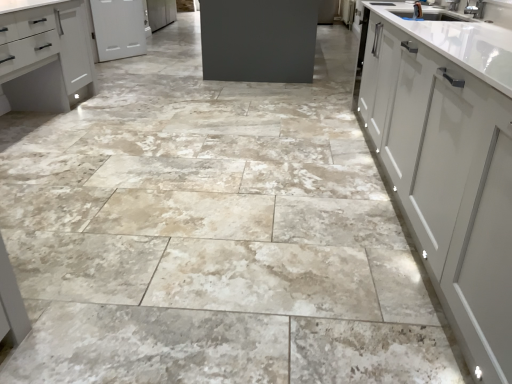
Locate an element on the screen. free location to the right of white matte cabinet at upper left, marked as the first cabinetry in a top-to-bottom arrangement is located at coordinates point(151,60).